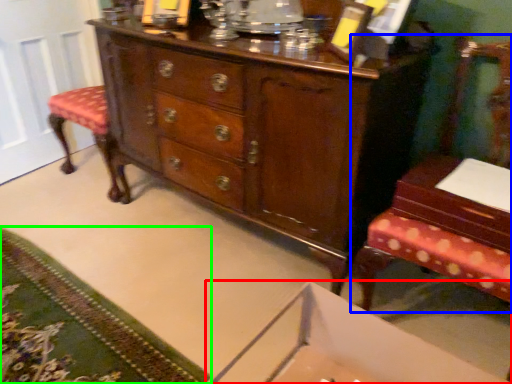
Question: Which is farther away from changing table (highlighted by a red box)? furniture (highlighted by a blue box) or mat (highlighted by a green box)?

Choices:
 (A) furniture
 (B) mat

Answer: (B)